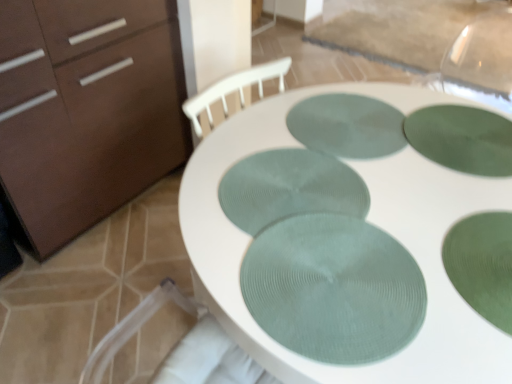
Identify the location of vacant area on top of green textured glass plate at center, the third glass plate when ordered from front to back (from a real-world perspective). (293, 190).